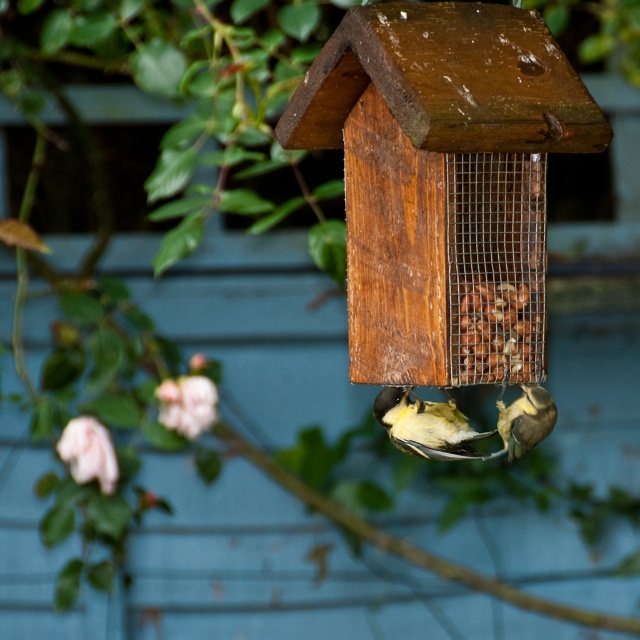
Does brown matte nuts at center have a greater height compared to yellow-green feathers at center?

Yes.

Where is `brown matte nuts at center`? The image size is (640, 640). brown matte nuts at center is located at coordinates (496, 332).

The image size is (640, 640). Identify the location of brown matte nuts at center. (496, 332).

Is wooden bird feeder at center bigger than yellow-green feathers at center?

Indeed, wooden bird feeder at center has a larger size compared to yellow-green feathers at center.

Is wooden bird feeder at center further to the viewer compared to yellow-green feathers at center?

No, wooden bird feeder at center is in front of yellow-green feathers at center.

Where is `wooden bird feeder at center`? wooden bird feeder at center is located at coordinates (440, 172).

Who is more forward, (448, 307) or (520, 300)?

Point (448, 307) is more forward.

What do you see at coordinates (440, 172) in the screenshot?
I see `wooden bird feeder at center` at bounding box center [440, 172].

At what (x,y) coordinates should I click in order to perform the action: click on wooden bird feeder at center. Please return your answer as a coordinate pair (x, y). This screenshot has width=640, height=640. Looking at the image, I should click on coord(440,172).